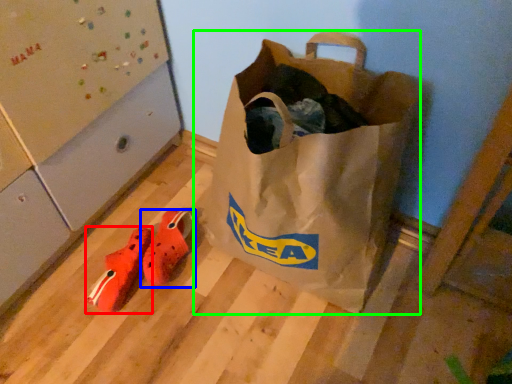
Question: Which object is the closest to the shoe (highlighted by a red box)? Choose among these: footwear (highlighted by a blue box) or luggage and bags (highlighted by a green box).

Choices:
 (A) footwear
 (B) luggage and bags

Answer: (A)